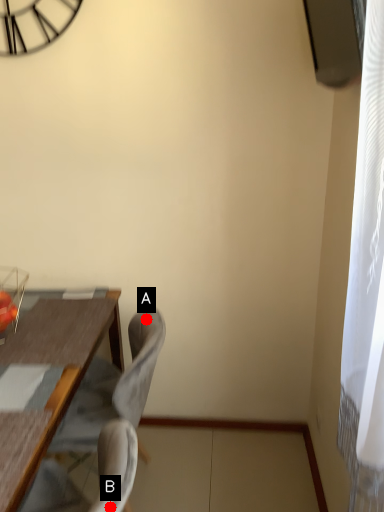
Question: Two points are circled on the image, labeled by A and B beside each circle. Among these points, which one is nearest to the camera?

Choices:
 (A) A is closer
 (B) B is closer

Answer: (B)